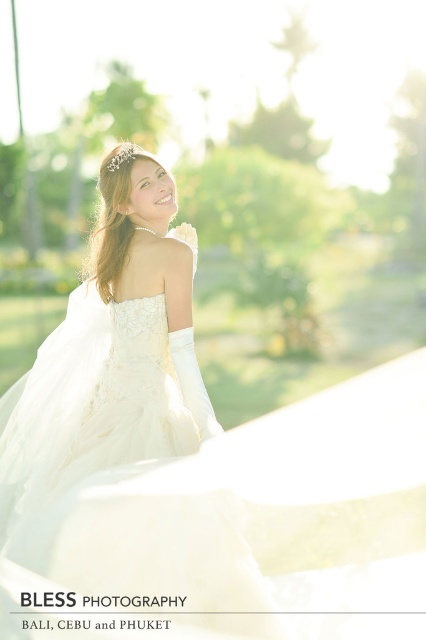
Between ivory satin dress at center and silver metallic tiara at upper center, which one appears on the left side from the viewer's perspective?

Positioned to the left is ivory satin dress at center.

Can you confirm if ivory satin dress at center is thinner than silver metallic tiara at upper center?

Incorrect, ivory satin dress at center's width is not less than silver metallic tiara at upper center's.

Does point (173, 230) come farther from viewer compared to point (115, 160)?

Yes, it is.

Find the location of `ivory satin dress at center`. ivory satin dress at center is located at coordinates (112, 355).